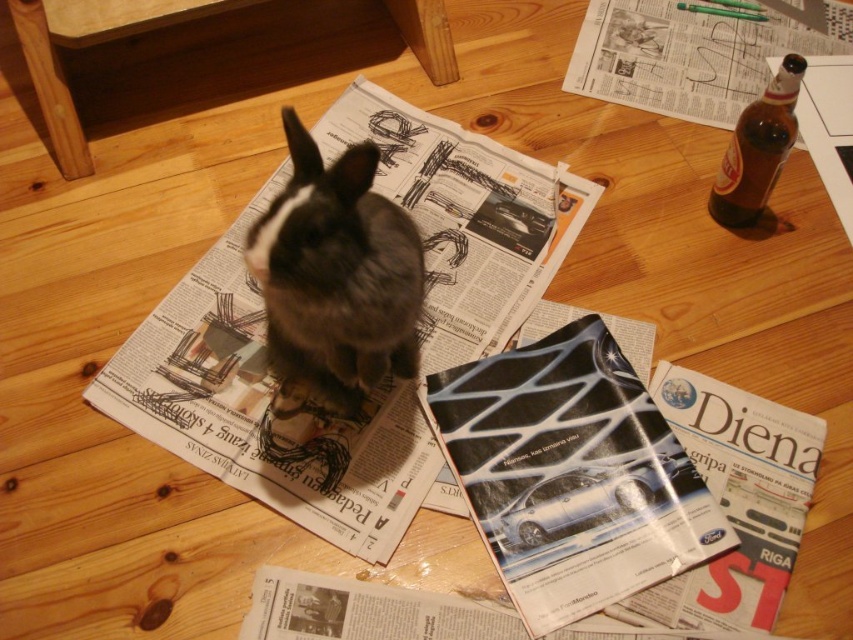
Question: Which object appears farthest from the camera in this image?

Choices:
 (A) fuzzy brown rabbit at center
 (B) matte black magazine at center
 (C) white paper at upper right
 (D) brown glass bottle at upper right

Answer: (C)

Question: Which object is positioned closest to the matte black magazine at center?

Choices:
 (A) white printed newspaper at center
 (B) brown glass bottle at upper right
 (C) white paper at upper right

Answer: (A)

Question: Which of these objects is positioned closest to the fuzzy brown rabbit at center?

Choices:
 (A) matte black magazine at center
 (B) white paper at upper right
 (C) brown glass bottle at upper right
 (D) white printed newspaper at center

Answer: (D)

Question: Does matte black magazine at center appear over brown glass bottle at upper right?

Choices:
 (A) no
 (B) yes

Answer: (A)

Question: Is white printed newspaper at center wider than brown glass bottle at upper right?

Choices:
 (A) no
 (B) yes

Answer: (B)

Question: Considering the relative positions of white printed newspaper at center and white paper at upper right in the image provided, where is white printed newspaper at center located with respect to white paper at upper right?

Choices:
 (A) above
 (B) below

Answer: (B)